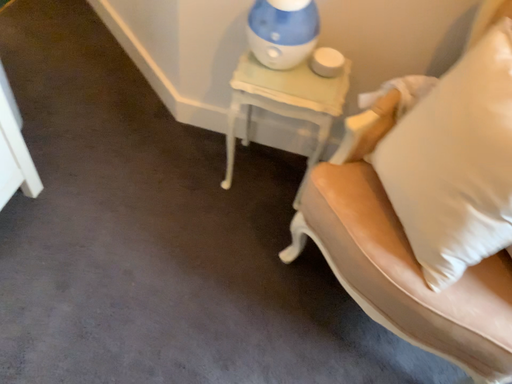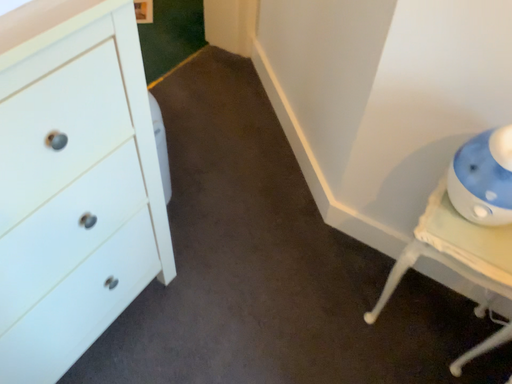
Question: How did the camera likely rotate when shooting the video?

Choices:
 (A) rotated left
 (B) rotated right

Answer: (A)